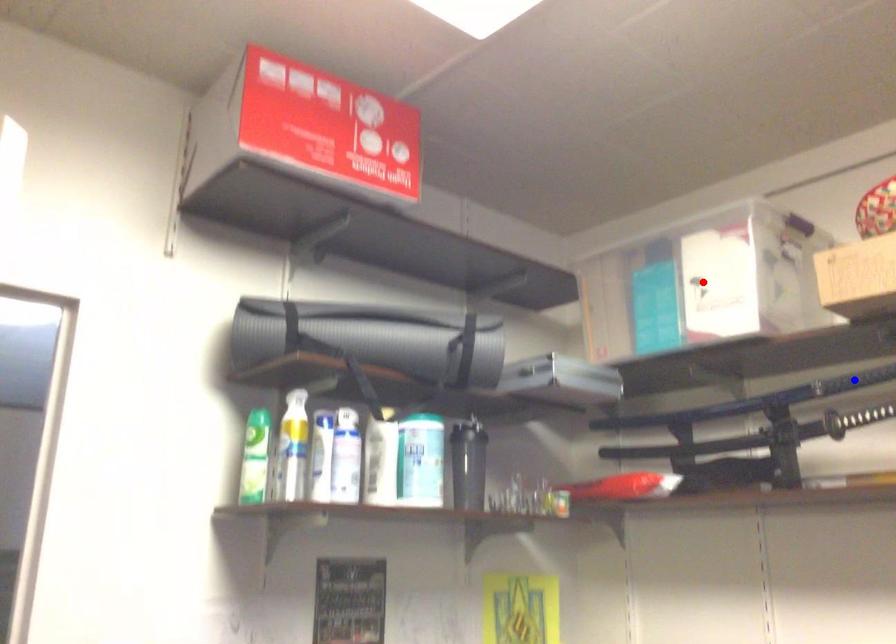
Question: Which of the two points in the image is closer to the camera?

Choices:
 (A) Blue point is closer.
 (B) Red point is closer.

Answer: (A)